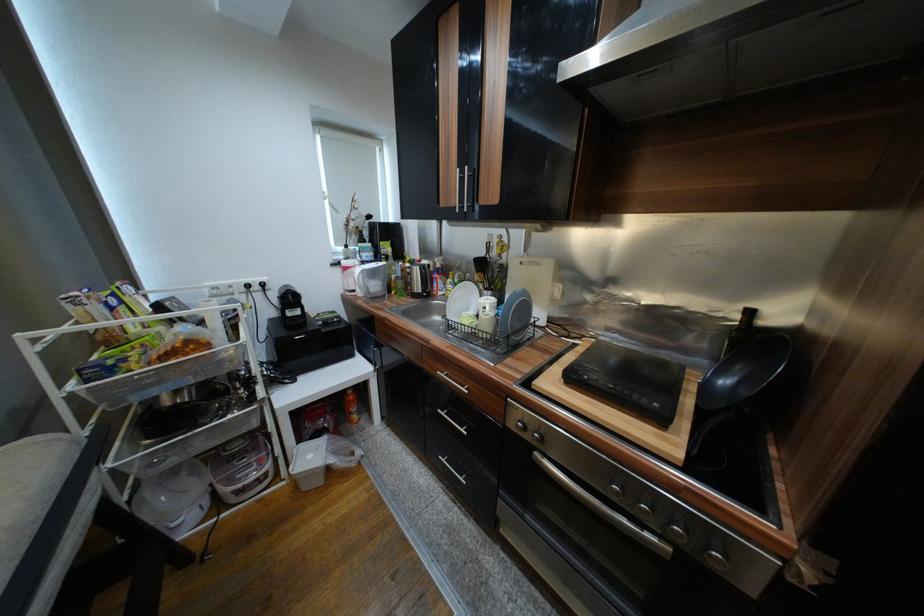
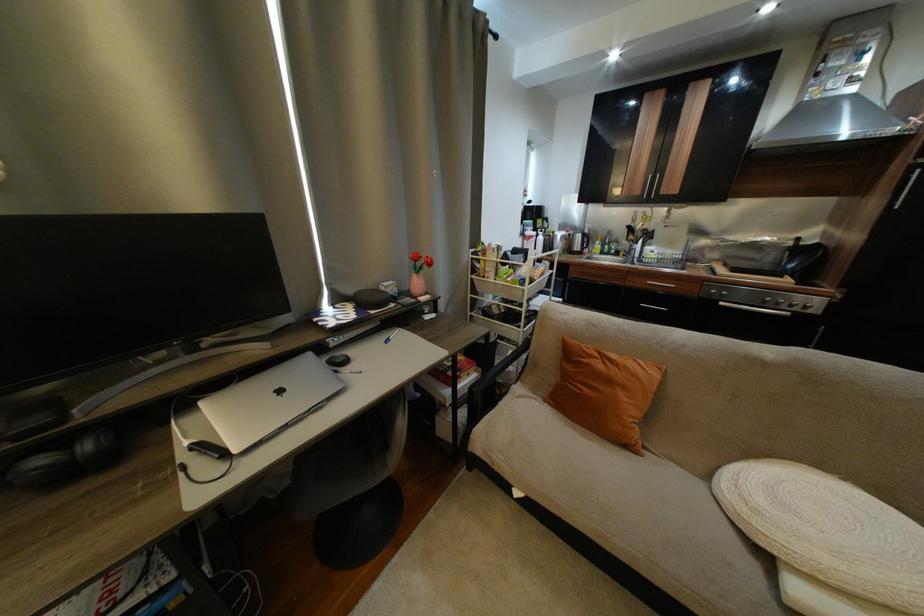
The images are taken continuously from a first-person perspective. In which direction are you moving?

The cameraman walked toward left, backward.